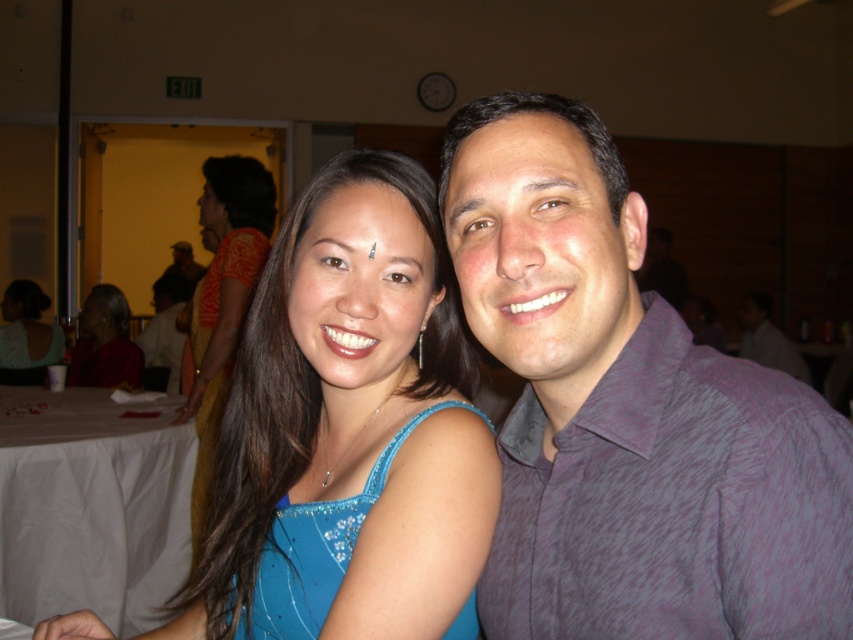
Looking at this image, you are attending a cultural event and notice two garments displayed on a mannequin in the center of the room. The garments are the blue silk saree at center and the matte green blouse at center. Based on their positions, which garment is positioned lower on the mannequin?

The blue silk saree at center is positioned lower on the mannequin than the matte green blouse at center because the blue silk saree at center is below matte green blouse at center.